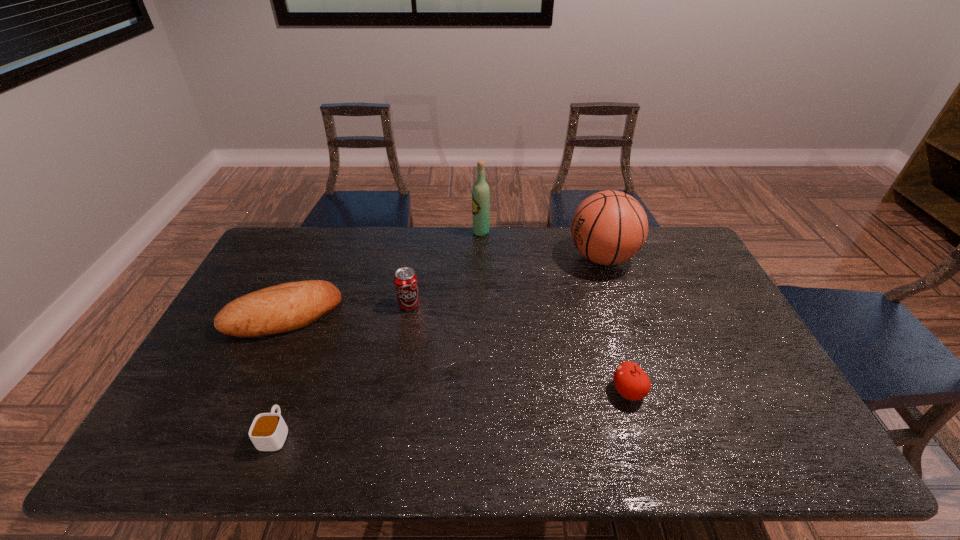
Find the location of `vacant area located on the front-facing side of the third object from right to left`. vacant area located on the front-facing side of the third object from right to left is located at coordinates (427, 232).

Find the location of a particular element. Image resolution: width=960 pixels, height=540 pixels. free space located 0.080m on the front-facing side of the third object from right to left is located at coordinates (451, 232).

Image resolution: width=960 pixels, height=540 pixels. What are the coordinates of `blank space located 0.050m on the surface of the basketball near the brand logo` in the screenshot? It's located at (553, 257).

The image size is (960, 540). What are the coordinates of `free space located 0.160m on the surface of the basketball near the brand logo` in the screenshot? It's located at (521, 257).

Image resolution: width=960 pixels, height=540 pixels. I want to click on free space located 0.320m on the surface of the basketball near the brand logo, so click(476, 257).

This screenshot has width=960, height=540. I want to click on free spot located on the right of the soda, so click(468, 305).

At what (x,y) coordinates should I click in order to perform the action: click on vacant space positioned 0.100m on the back of the apple. Please return your answer as a coordinate pair (x, y). The height and width of the screenshot is (540, 960). Looking at the image, I should click on (615, 347).

Where is `vacant space positioned 0.170m on the back of the bread`? This screenshot has width=960, height=540. vacant space positioned 0.170m on the back of the bread is located at coordinates (310, 258).

At what (x,y) coordinates should I click in order to perform the action: click on vacant region located on the side with the handle of the cup. Please return your answer as a coordinate pair (x, y). Looking at the image, I should click on (316, 327).

The width and height of the screenshot is (960, 540). I want to click on free space located 0.120m on the side with the handle of the cup, so click(298, 375).